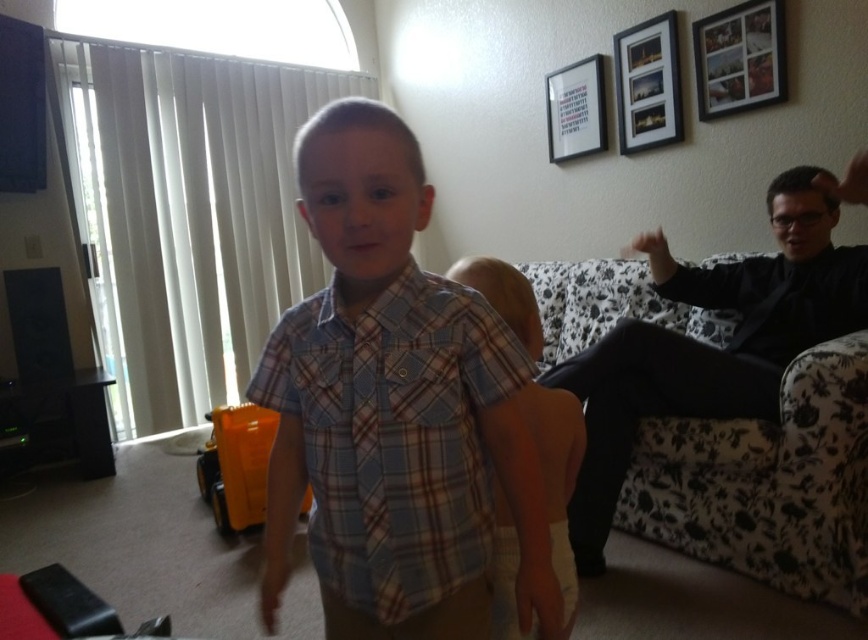
Who is higher up, wooden photo frame at upper right or wooden picture frame at upper right?

wooden picture frame at upper right is higher up.

Locate an element on the screen. wooden photo frame at upper right is located at coordinates (740, 58).

Does plaid cotton shirt at center appear over wooden picture frame at upper right?

Actually, plaid cotton shirt at center is below wooden picture frame at upper right.

Where is `plaid cotton shirt at center`? plaid cotton shirt at center is located at coordinates (398, 449).

Identify the location of plaid cotton shirt at center. The image size is (868, 640). (398, 449).

Identify the location of plaid cotton shirt at center. (398, 449).

Can you confirm if black smooth shirt at right is positioned above plaid fabric shirt at center?

Yes.

I want to click on black smooth shirt at right, so click(x=709, y=346).